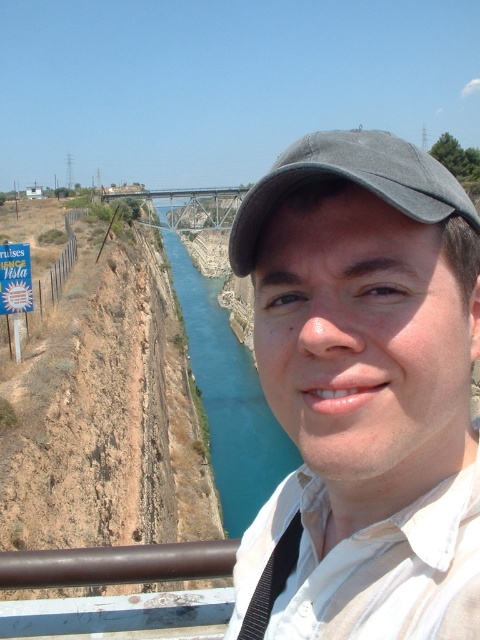
Question: Which is nearer to the blue paper sign at upper left?

Choices:
 (A) blue water at center
 (B) gray fabric cap at center
 (C) metal bridge at center

Answer: (B)

Question: Considering the real-world distances, which object is farthest from the white cotton shirt at center?

Choices:
 (A) gray fabric cap at center
 (B) blue water at center
 (C) metal bridge at center

Answer: (C)

Question: Considering the relative positions of gray fabric cap at center and blue paper sign at upper left in the image provided, where is gray fabric cap at center located with respect to blue paper sign at upper left?

Choices:
 (A) right
 (B) left

Answer: (A)

Question: Does blue water at center have a smaller size compared to metal bridge at center?

Choices:
 (A) no
 (B) yes

Answer: (A)

Question: Does gray fabric cap at center lie in front of blue paper sign at upper left?

Choices:
 (A) yes
 (B) no

Answer: (A)

Question: Based on their relative distances, which object is farther from the gray fabric cap at center?

Choices:
 (A) metal bridge at center
 (B) blue water at center

Answer: (A)